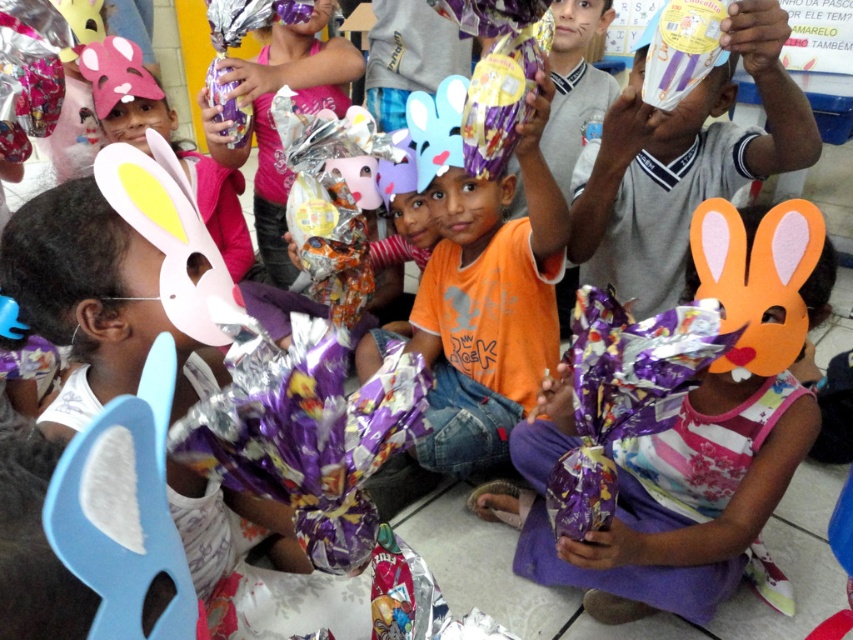
Does point (432, 419) lie behind point (740, 17)?

Yes, it is behind point (740, 17).

Who is more distant from viewer, (x=430, y=259) or (x=627, y=275)?

The point (x=430, y=259) is behind.

Where is `orange matte shirt at center`? This screenshot has height=640, width=853. orange matte shirt at center is located at coordinates (486, 305).

Describe the element at coordinates (693, 436) in the screenshot. The width and height of the screenshot is (853, 640). I see `orange felt mask at center` at that location.

At what (x,y) coordinates should I click in order to perform the action: click on orange felt mask at center. Please return your answer as a coordinate pair (x, y). Image resolution: width=853 pixels, height=640 pixels. Looking at the image, I should click on (693, 436).

Can you confirm if orange felt mask at center is positioned to the left of orange matte shirt at center?

Incorrect, orange felt mask at center is not on the left side of orange matte shirt at center.

Can you confirm if orange felt mask at center is positioned below orange matte shirt at center?

Yes, orange felt mask at center is below orange matte shirt at center.

You are a GUI agent. You are given a task and a screenshot of the screen. Output one action in this format:
    pyautogui.click(x=<x>, y=<y>)
    Task: Click on the orange felt mask at center
    The height and width of the screenshot is (640, 853).
    Given the screenshot: What is the action you would take?
    pyautogui.click(x=693, y=436)